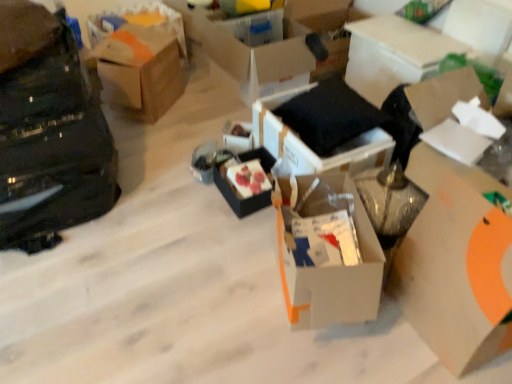
Find the location of a particular element. The image size is (512, 384). empty space that is in between black matte bag at left and white cardboard box at center, which ranks as the fourth box in left-to-right order is located at coordinates pyautogui.click(x=175, y=240).